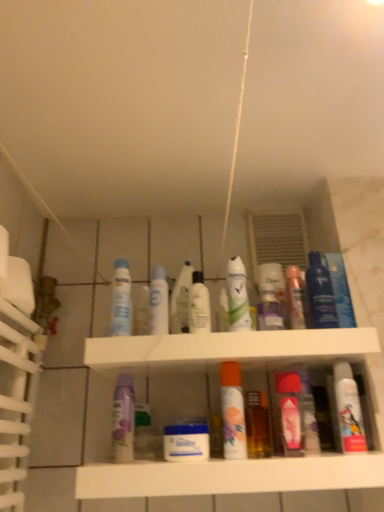
Question: Are blue plastic container at center, which appears as the fourth mouthwash when viewed from the left, and blue glossy mouthwash at upper right, the 2th mouthwash positioned from the right, far apart?

Choices:
 (A) no
 (B) yes

Answer: (A)

Question: Does blue plastic container at center, which appears as the fourth mouthwash when viewed from the left, appear on the right side of blue glossy mouthwash at upper right, which ranks as the 9th mouthwash in left-to-right order?

Choices:
 (A) yes
 (B) no

Answer: (B)

Question: Is blue plastic container at center, the seventh mouthwash when ordered from right to left, to the left of blue glossy mouthwash at upper right, which ranks as the 9th mouthwash in left-to-right order, from the viewer's perspective?

Choices:
 (A) no
 (B) yes

Answer: (B)

Question: Does blue plastic container at center, which appears as the fourth mouthwash when viewed from the left, lie behind blue glossy mouthwash at upper right, which ranks as the 9th mouthwash in left-to-right order?

Choices:
 (A) no
 (B) yes

Answer: (A)

Question: Are blue plastic container at center, which appears as the fourth mouthwash when viewed from the left, and blue glossy mouthwash at upper right, the 2th mouthwash positioned from the right, making contact?

Choices:
 (A) yes
 (B) no

Answer: (B)

Question: Does blue plastic container at center, the seventh mouthwash when ordered from right to left, have a lesser height compared to blue glossy mouthwash at upper right, which ranks as the 9th mouthwash in left-to-right order?

Choices:
 (A) yes
 (B) no

Answer: (A)

Question: Does clear plastic bottle at center, which appears as the 5th mouthwash when viewed from the left, have a smaller size compared to pink glossy mouthwash at center, acting as the eighth mouthwash starting from the left?

Choices:
 (A) no
 (B) yes

Answer: (A)

Question: Does clear plastic bottle at center, which appears as the 5th mouthwash when viewed from the left, have a lesser height compared to pink glossy mouthwash at center, placed as the third mouthwash when sorted from right to left?

Choices:
 (A) yes
 (B) no

Answer: (A)

Question: Are clear plastic bottle at center, the 6th mouthwash viewed from the right, and pink glossy mouthwash at center, acting as the eighth mouthwash starting from the left, far apart?

Choices:
 (A) no
 (B) yes

Answer: (A)

Question: Can you see clear plastic bottle at center, the 6th mouthwash viewed from the right, touching pink glossy mouthwash at center, placed as the third mouthwash when sorted from right to left?

Choices:
 (A) no
 (B) yes

Answer: (A)

Question: Is clear plastic bottle at center, which appears as the 5th mouthwash when viewed from the left, further to the viewer compared to pink glossy mouthwash at center, placed as the third mouthwash when sorted from right to left?

Choices:
 (A) yes
 (B) no

Answer: (A)

Question: Considering the relative sizes of clear plastic bottle at center, the 6th mouthwash viewed from the right, and pink glossy mouthwash at center, placed as the third mouthwash when sorted from right to left, in the image provided, is clear plastic bottle at center, the 6th mouthwash viewed from the right, bigger than pink glossy mouthwash at center, placed as the third mouthwash when sorted from right to left,?

Choices:
 (A) no
 (B) yes

Answer: (B)

Question: Does white glossy mouthwash at center, arranged as the 9th mouthwash when viewed from the right, come in front of matte purple lotion at center, which is the 2th toiletry from right to left?

Choices:
 (A) no
 (B) yes

Answer: (B)